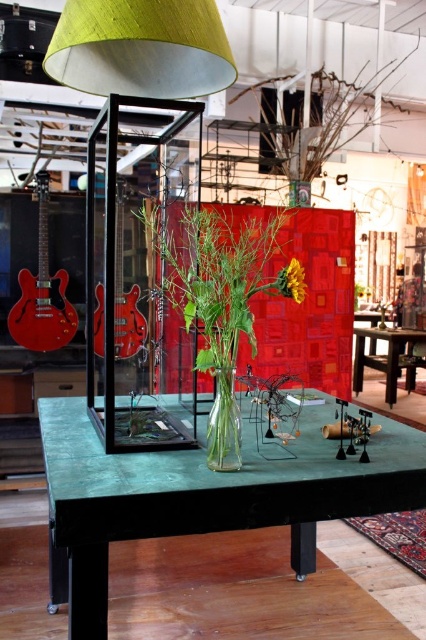
Who is more distant from viewer, [213,285] or [285,266]?

Point [285,266]

Is the position of clear glass vase at center less distant than that of yellow matte sunflower at center?

Yes, it is.

Measure the distance between point (218, 344) and camera.

Point (218, 344) is 4.58 feet away from camera.

Find the location of `clear glass vase at center`. clear glass vase at center is located at coordinates (215, 301).

Does clear glass vase at center have a lesser width compared to transparent glass vase at center?

Incorrect, clear glass vase at center's width is not less than transparent glass vase at center's.

Who is more forward, (222, 358) or (238, 445)?

Point (238, 445) is in front.

Where is `clear glass vase at center`? clear glass vase at center is located at coordinates (215, 301).

Between point (112, 410) and point (293, 294), which one is positioned behind?

Positioned behind is point (112, 410).

Does green fabric lampshade at center have a greater width compared to yellow matte sunflower at center?

Yes, green fabric lampshade at center is wider than yellow matte sunflower at center.

Which is behind, point (126, 88) or point (302, 296)?

The point (126, 88) is behind.

Locate an element on the screen. This screenshot has height=640, width=426. green fabric lampshade at center is located at coordinates (134, 104).